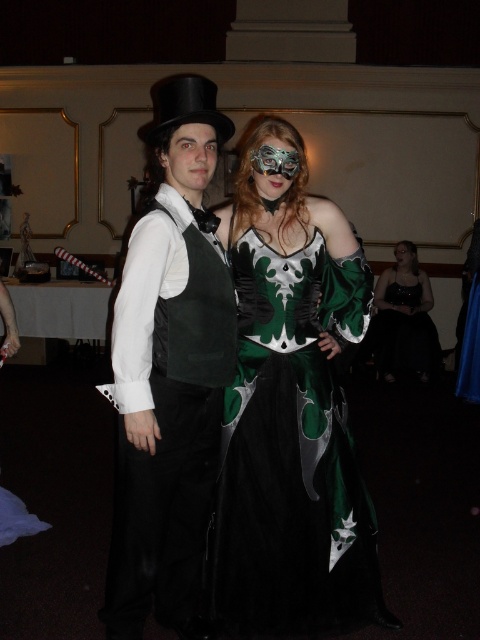
Which is more to the left, green satin dress at center or matte black mask at center?

green satin dress at center

Looking at this image, does green satin dress at center appear on the right side of matte black mask at center?

In fact, green satin dress at center is to the left of matte black mask at center.

Does point (322, 211) come in front of point (400, 243)?

That is True.

Find the location of a particular element. green satin dress at center is located at coordinates (290, 416).

Is matte black face at center bigger than metallic mask at center?

Indeed, matte black face at center has a larger size compared to metallic mask at center.

Does matte black face at center come in front of metallic mask at center?

Yes, it is in front of metallic mask at center.

Between point (212, 147) and point (272, 173), which one is positioned behind?

Positioned behind is point (272, 173).

Identify the location of matte black face at center. (191, 160).

Consider the image. Does black satin dress at lower right appear under metallic mask at center?

Indeed, black satin dress at lower right is positioned under metallic mask at center.

Who is lower down, black satin dress at lower right or metallic mask at center?

black satin dress at lower right

Describe the element at coordinates (405, 323) in the screenshot. The height and width of the screenshot is (640, 480). I see `black satin dress at lower right` at that location.

Where is `black satin dress at lower right`? Image resolution: width=480 pixels, height=640 pixels. black satin dress at lower right is located at coordinates tap(405, 323).